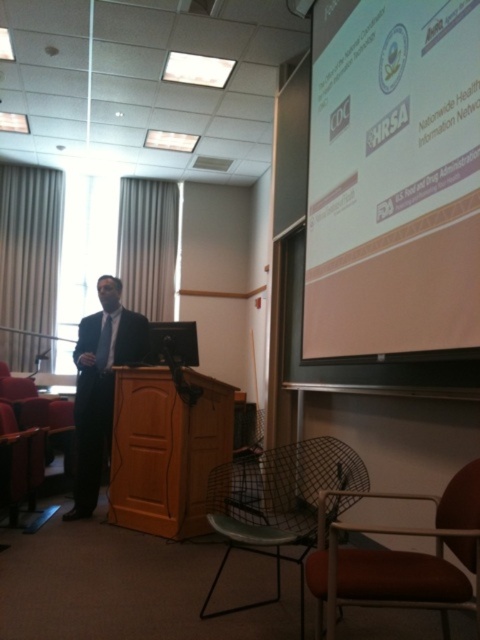
Who is lower down, orange fabric chair at lower right or leather seat at lower left?

Positioned lower is leather seat at lower left.

Does point (347, 560) come closer to viewer compared to point (19, 440)?

Yes, point (347, 560) is closer to viewer.

Find the location of a particular element. orange fabric chair at lower right is located at coordinates (404, 557).

I want to click on orange fabric chair at lower right, so click(404, 557).

Is wooden podium at center smaller than black suit at center?

Yes, wooden podium at center is smaller than black suit at center.

Does wooden podium at center have a lesser width compared to black suit at center?

No, wooden podium at center is not thinner than black suit at center.

Is point (151, 368) closer to camera compared to point (108, 417)?

Yes, it is in front of point (108, 417).

Locate an element on the screen. The height and width of the screenshot is (640, 480). wooden podium at center is located at coordinates (166, 449).

Can you confirm if white matte projection screen at upper right is taller than orange fabric chair at lower right?

Yes, white matte projection screen at upper right is taller than orange fabric chair at lower right.

Is point (415, 77) farther from viewer compared to point (420, 582)?

That is True.

The image size is (480, 640). Identify the location of white matte projection screen at upper right. (393, 177).